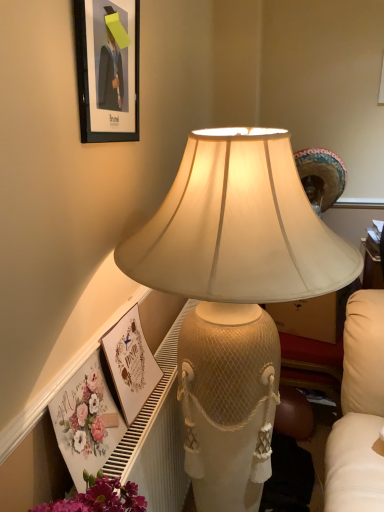
Question: Considering their positions, is matte white picture frame at lower center, the 1th picture frame positioned from the bottom, located in front of or behind matte cream lampshade at center?

Choices:
 (A) front
 (B) behind

Answer: (B)

Question: In terms of width, does matte white picture frame at lower center, the 1th picture frame positioned from the bottom, look wider or thinner when compared to matte cream lampshade at center?

Choices:
 (A) thin
 (B) wide

Answer: (A)

Question: Estimate the real-world distances between objects in this image. Which object is farther from the matte black frame at upper left, which is the 1th picture frame in top-to-bottom order?

Choices:
 (A) matte cream lampshade at center
 (B) matte white picture frame at lower center, the 1th picture frame positioned from the bottom

Answer: (B)

Question: Which object is the farthest from the matte white picture frame at lower center, the 1th picture frame positioned from the bottom?

Choices:
 (A) matte black frame at upper left, which is the 1th picture frame in top-to-bottom order
 (B) matte cream lampshade at center

Answer: (A)